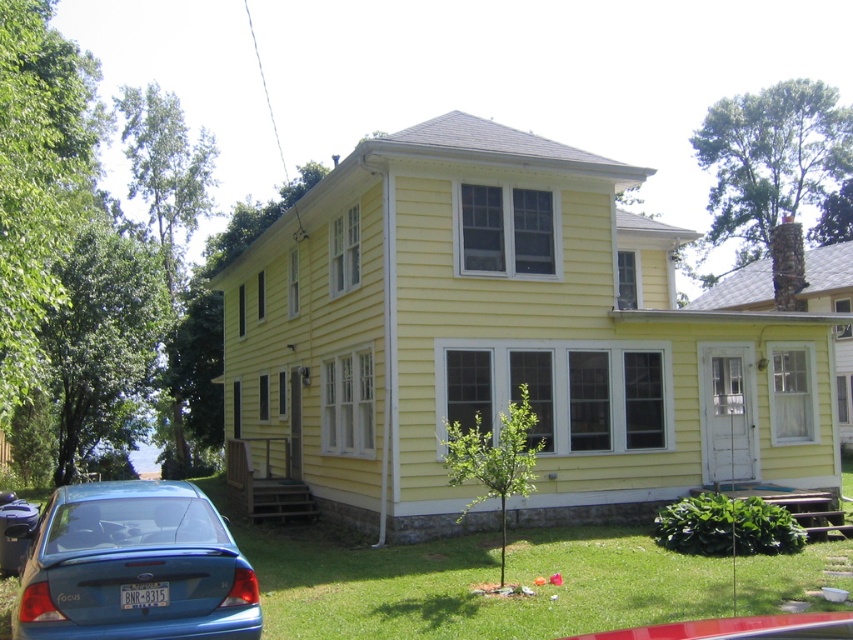
You are a delivery person approaching the house and need to park your vehicle. The blue matte sedan at lower left is already parked on the lawn. Where should you park your vehicle so that it is not blocking the yellow siding at center?

The yellow siding at center is located above the blue matte sedan at lower left, so parking behind or to the side of the blue matte sedan at lower left would prevent blocking the yellow siding at center.